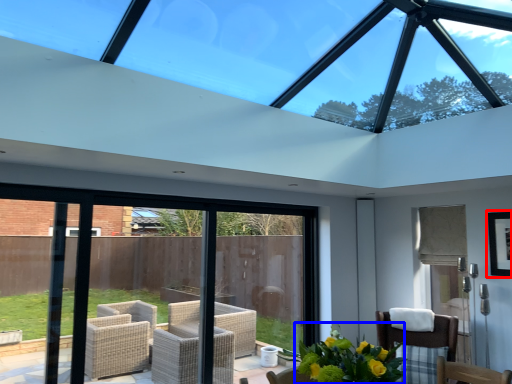
Question: Which object is further to the camera taking this photo, picture frame (highlighted by a red box) or floral arrangement (highlighted by a blue box)?

Choices:
 (A) picture frame
 (B) floral arrangement

Answer: (A)